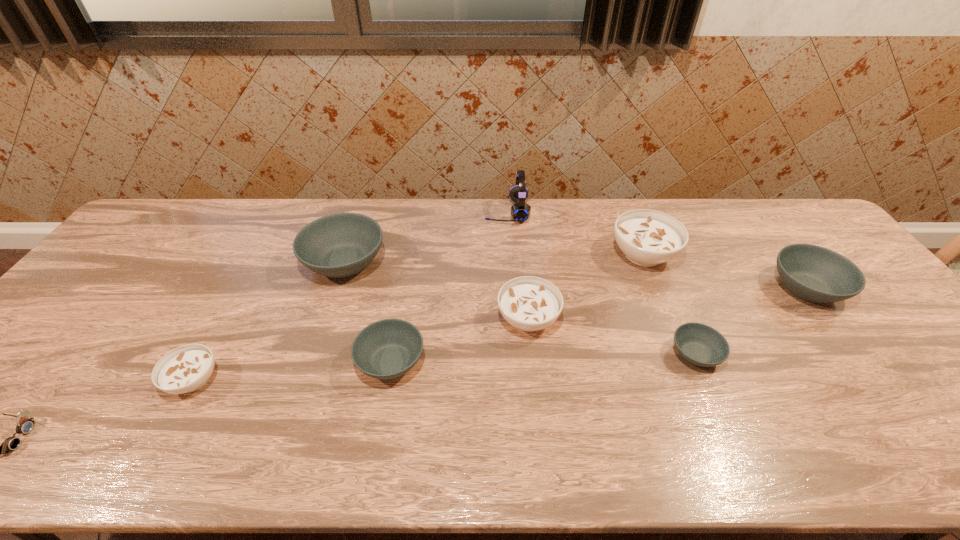
This screenshot has height=540, width=960. Find the location of `the fourth closest soup bowl to the second white soup bowl from right to left`. the fourth closest soup bowl to the second white soup bowl from right to left is located at coordinates (340, 245).

Locate an element on the screen. the closest white soup bowl to the third biggest gray soup bowl is located at coordinates (528, 303).

The height and width of the screenshot is (540, 960). Find the location of `the second closest white soup bowl to the smallest gray soup bowl`. the second closest white soup bowl to the smallest gray soup bowl is located at coordinates (528, 303).

Identify the location of gray soup bowl that is the second closest one to the second smallest white soup bowl. (701, 345).

At what (x,y) coordinates should I click in order to perform the action: click on gray soup bowl that can be found as the second closest to the tallest object. Please return your answer as a coordinate pair (x, y). Looking at the image, I should click on (386, 349).

Where is `vacant point that satisfies the following two spatial constraints: 1. on the ear cushions of the farthest object; 2. on the back side of the rightmost object`? vacant point that satisfies the following two spatial constraints: 1. on the ear cushions of the farthest object; 2. on the back side of the rightmost object is located at coordinates (x=512, y=288).

At what (x,y) coordinates should I click in order to perform the action: click on free space that satisfies the following two spatial constraints: 1. on the ear cushions of the farthest object; 2. on the left side of the rightmost object. Please return your answer as a coordinate pair (x, y). Looking at the image, I should click on (512, 288).

Locate an element on the screen. Image resolution: width=960 pixels, height=540 pixels. vacant space that satisfies the following two spatial constraints: 1. on the back side of the nearest white soup bowl; 2. on the left side of the second biggest white soup bowl is located at coordinates (227, 319).